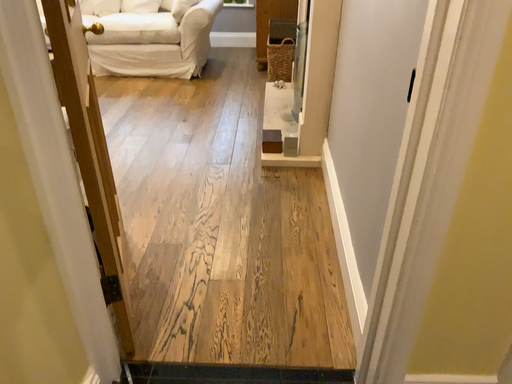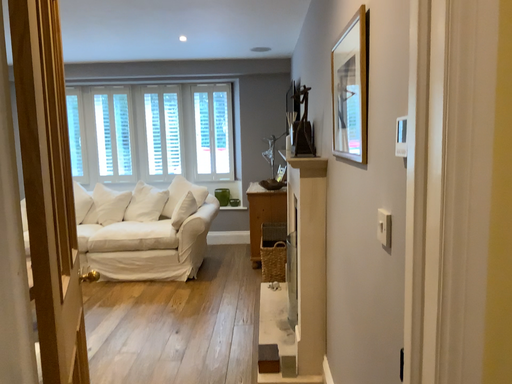
Question: Which way did the camera rotate in the video?

Choices:
 (A) rotated upward
 (B) rotated downward

Answer: (A)